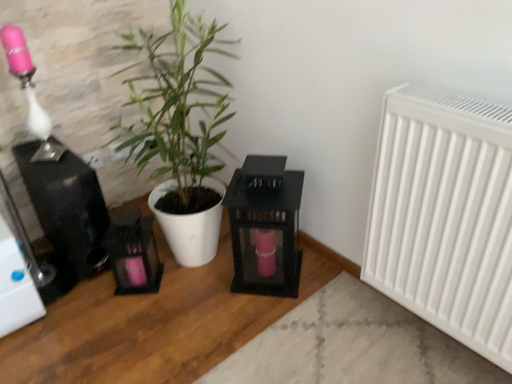
Where is `free spot to the right of black glass lantern at center`? free spot to the right of black glass lantern at center is located at coordinates (321, 280).